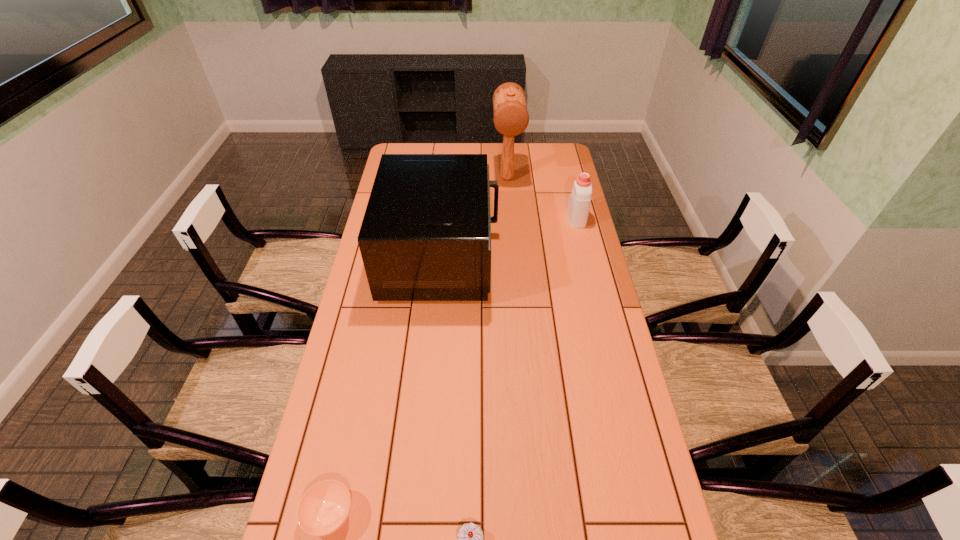
Locate an element on the screen. mallet is located at coordinates (511, 118).

Image resolution: width=960 pixels, height=540 pixels. Find the location of `the farthest object`. the farthest object is located at coordinates (511, 118).

I want to click on microwave_oven, so click(426, 233).

Locate an element on the screen. the third shortest object is located at coordinates (578, 206).

Identify the location of the rightmost object. (578, 206).

At what (x,y) coordinates should I click in order to perform the action: click on vacant space located on the strike surface of the mallet. Please return your answer as a coordinate pair (x, y). This screenshot has height=540, width=960. Looking at the image, I should click on tap(509, 204).

Where is `free space located 0.070m on the front-facing side of the second tallest object`? This screenshot has height=540, width=960. free space located 0.070m on the front-facing side of the second tallest object is located at coordinates (516, 256).

At what (x,y) coordinates should I click in order to perform the action: click on vacant space located 0.170m on the handle side of the rightmost object. Please return your answer as a coordinate pair (x, y). The height and width of the screenshot is (540, 960). Looking at the image, I should click on (568, 185).

At what (x,y) coordinates should I click in order to perform the action: click on vacant space located on the handle side of the rightmost object. Please return your answer as a coordinate pair (x, y). Image resolution: width=960 pixels, height=540 pixels. Looking at the image, I should click on click(570, 194).

Identify the location of vacant position located on the handle side of the rightmost object. (572, 200).